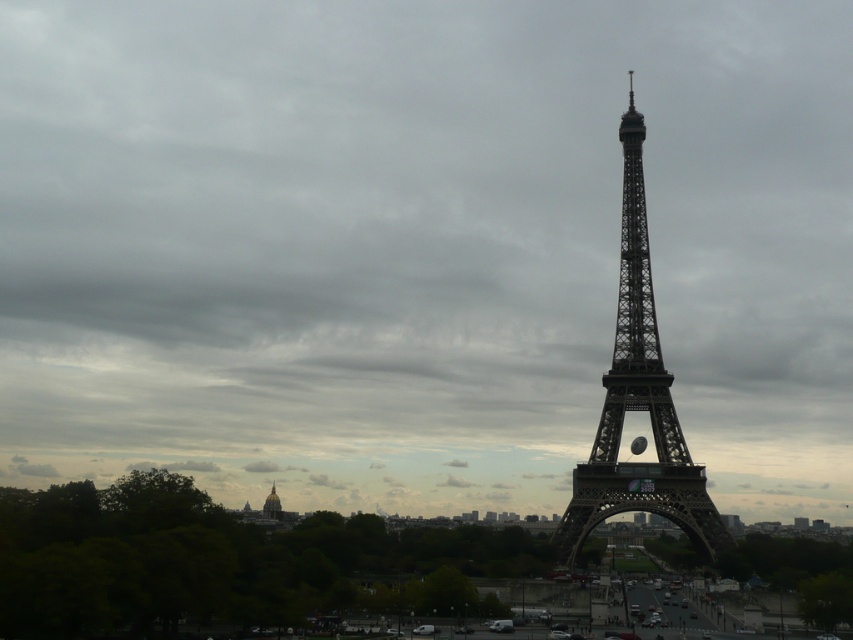
Question: Which point is closer to the camera?

Choices:
 (A) metallic structure at center
 (B) golden dome building at lower center

Answer: (A)

Question: Which of the following is the closest to the observer?

Choices:
 (A) golden dome building at lower center
 (B) metallic structure at center

Answer: (B)

Question: Can you confirm if metallic structure at center is positioned below golden dome building at lower center?

Choices:
 (A) yes
 (B) no

Answer: (B)

Question: Which point is closer to the camera taking this photo?

Choices:
 (A) (279, 509)
 (B) (683, 467)

Answer: (B)

Question: Does metallic structure at center have a smaller size compared to golden dome building at lower center?

Choices:
 (A) no
 (B) yes

Answer: (A)

Question: Is metallic structure at center bigger than golden dome building at lower center?

Choices:
 (A) no
 (B) yes

Answer: (B)